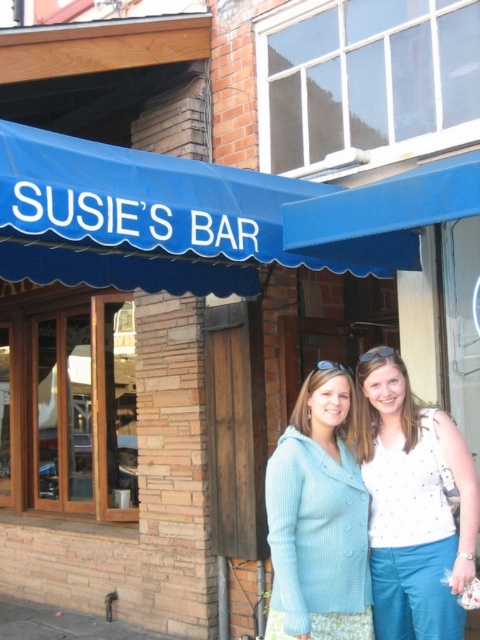
Question: Which point is closer to the camera?

Choices:
 (A) blue fabric awning at upper center
 (B) light blue knit sweater at center

Answer: (B)

Question: Which of the following is the closest to the observer?

Choices:
 (A) blue fabric awning at upper center
 (B) light blue knit sweater at center

Answer: (B)

Question: Considering the relative positions of blue fabric awning at upper center and light blue knit sweater at center in the image provided, where is blue fabric awning at upper center located with respect to light blue knit sweater at center?

Choices:
 (A) above
 (B) below

Answer: (A)

Question: Is white dotted blouse at center below light blue knit sweater at center?

Choices:
 (A) no
 (B) yes

Answer: (A)

Question: Is blue fabric awning at upper center wider than light blue knit sweater at center?

Choices:
 (A) no
 (B) yes

Answer: (B)

Question: Which point is closer to the camera?

Choices:
 (A) white dotted blouse at center
 (B) blue fabric awning at upper center
 (C) light blue knit sweater at center

Answer: (C)